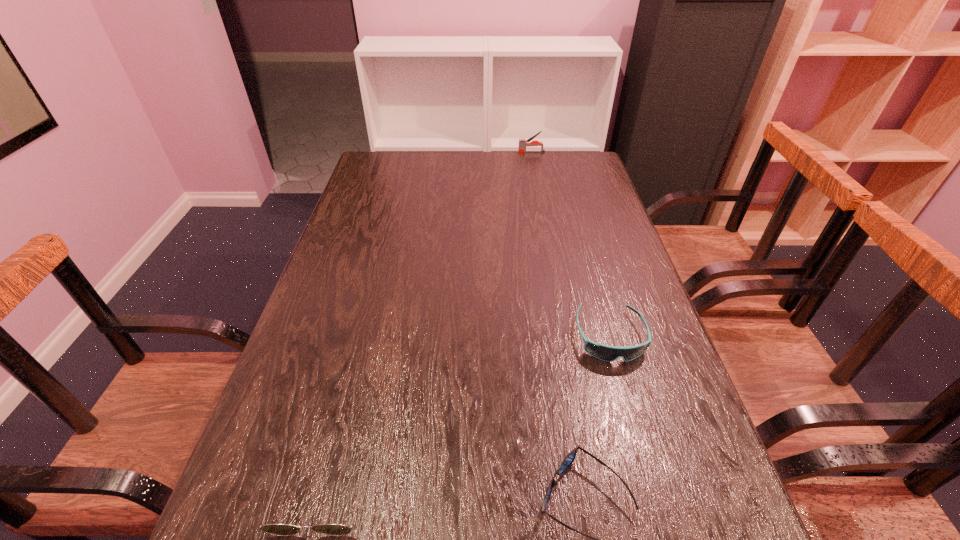
Find the location of `stapler`. stapler is located at coordinates [523, 143].

Where is `the farthest object`? The height and width of the screenshot is (540, 960). the farthest object is located at coordinates (523, 143).

Find the location of a particular element. The width and height of the screenshot is (960, 540). the second farthest object is located at coordinates (603, 352).

What are the coordinates of `the leftmost sunglasses` in the screenshot? It's located at (274, 529).

Locate an element on the screen. vacant space located on the handle side of the farthest object is located at coordinates (465, 152).

Identify the location of vacant space located 0.310m on the handle side of the farthest object. The width and height of the screenshot is (960, 540). (436, 152).

Where is `free space located 0.270m on the handle side of the farthest object`? This screenshot has width=960, height=540. free space located 0.270m on the handle side of the farthest object is located at coordinates (446, 152).

You are a GUI agent. You are given a task and a screenshot of the screen. Output one action in this format:
    pyautogui.click(x=<x>, y=<y>)
    Task: Click on the free space located on the front-facing side of the second farthest object
    The image size is (960, 540).
    Given the screenshot: What is the action you would take?
    pyautogui.click(x=661, y=519)

Locate an element on the screen. Image resolution: width=960 pixels, height=540 pixels. object located in the far edge section of the desktop is located at coordinates (523, 143).

At what (x,y) coordinates should I click in order to perform the action: click on object positioned at the left edge. Please return your answer as a coordinate pair (x, y). The width and height of the screenshot is (960, 540). Looking at the image, I should click on (274, 529).